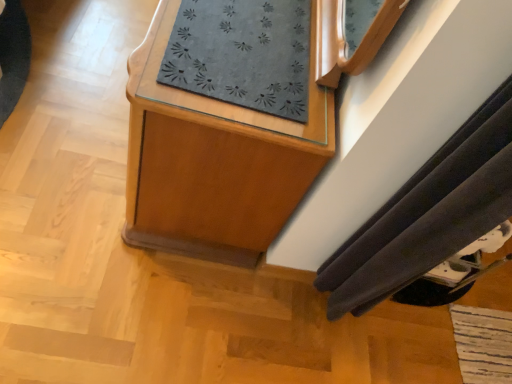
Question: Should I look upward or downward to see wooden cabinet at center?

Choices:
 (A) down
 (B) up

Answer: (B)